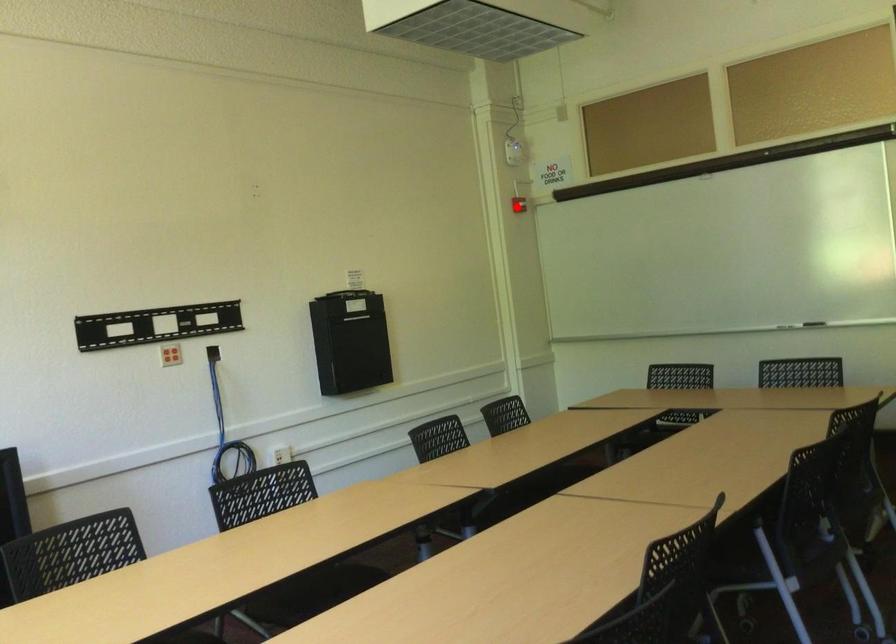
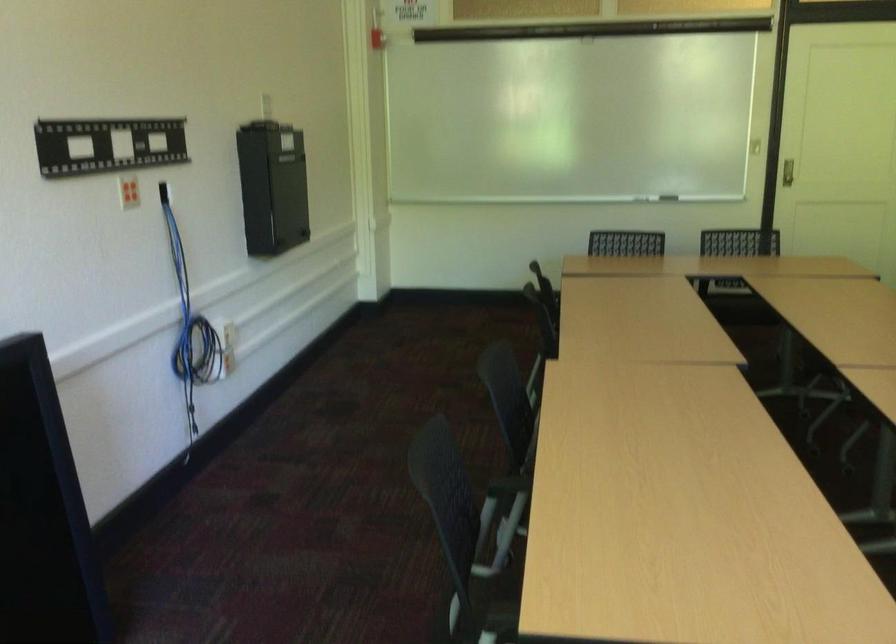
Locate, in the second image, the point that corresponds to the highlighted location in the first image.

(375, 38)